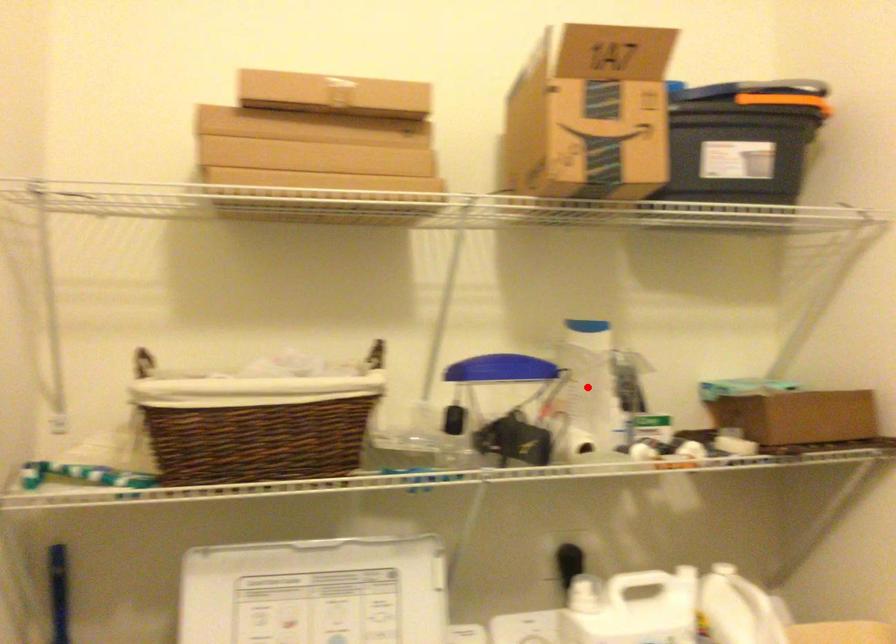
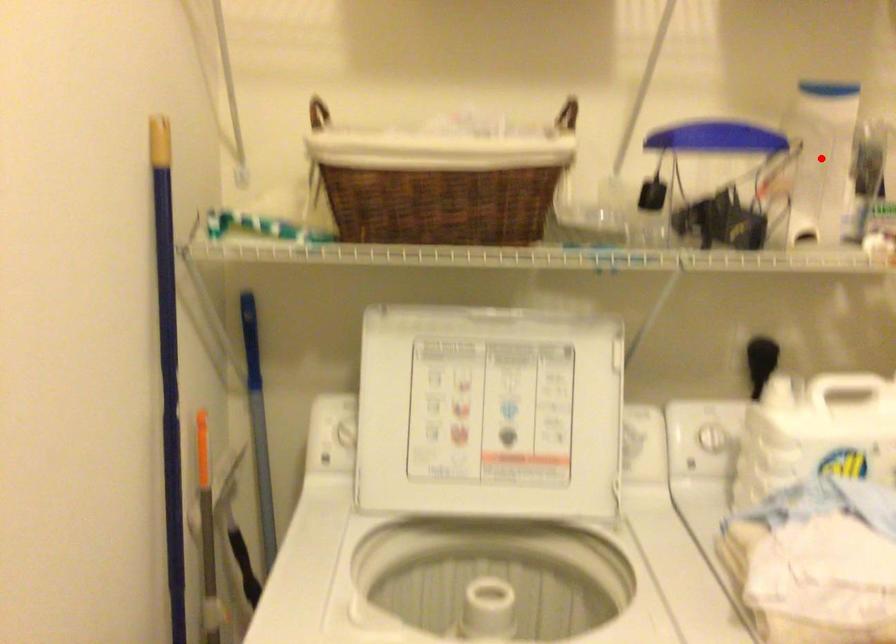
I am providing you with two images of the same scene from different viewpoints. A red point is marked on the first image and another point is marked on the second image. Does the point marked in image1 correspond to the same location as the one in image2?

Yes